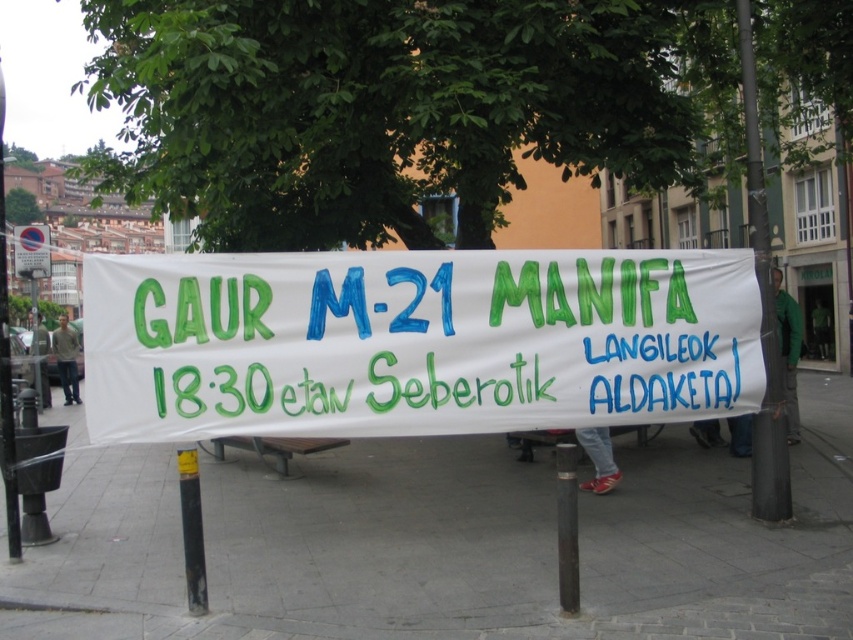
Does white concrete pavement at center have a greater height compared to white paper banner at center?

No, white concrete pavement at center is not taller than white paper banner at center.

Is white concrete pavement at center to the right of white paper banner at center from the viewer's perspective?

In fact, white concrete pavement at center is to the left of white paper banner at center.

Between point (119, 512) and point (131, 304), which one is positioned behind?

The point (119, 512) is behind.

Locate an element on the screen. The width and height of the screenshot is (853, 640). white concrete pavement at center is located at coordinates (448, 545).

Is white paper banner at center positioned in front of smooth gray pole at right?

Yes, white paper banner at center is closer to the viewer.

Who is more distant from viewer, (474, 428) or (780, 388)?

Point (780, 388)

Is point (503, 403) farther from camera compared to point (776, 388)?

No, it is in front of (776, 388).

This screenshot has height=640, width=853. Identify the location of white paper banner at center. (415, 340).

Which is above, smooth gray pole at right or blue circular sign at upper left?

Positioned higher is blue circular sign at upper left.

Is smooth gray pole at right positioned behind blue circular sign at upper left?

No, it is in front of blue circular sign at upper left.

Between point (779, 388) and point (25, 273), which one is positioned in front?

Point (779, 388)

Locate an element on the screen. smooth gray pole at right is located at coordinates (763, 310).